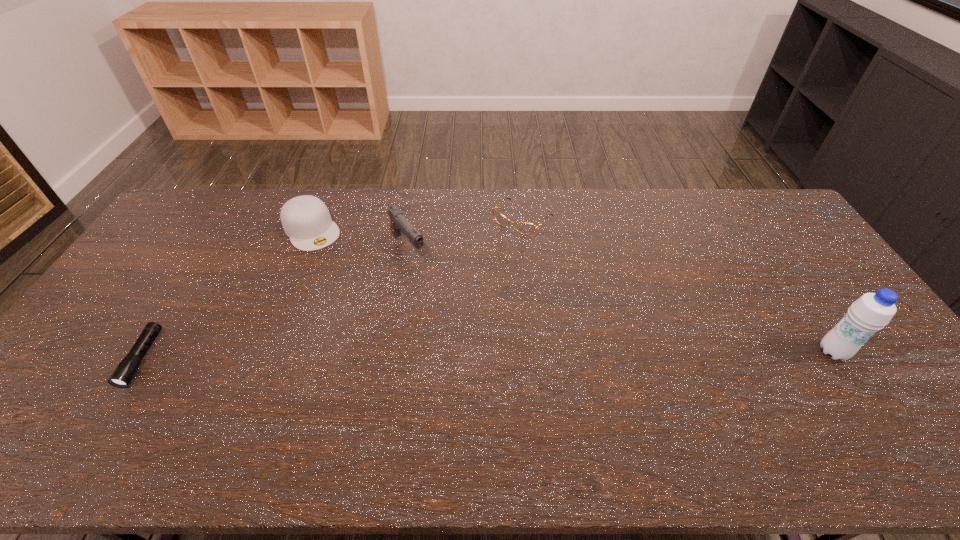
Find the location of `vacant space that's between the spectacles and the leftmost object`. vacant space that's between the spectacles and the leftmost object is located at coordinates (332, 288).

Where is `empty location between the third tallest object and the flashlight`? This screenshot has width=960, height=540. empty location between the third tallest object and the flashlight is located at coordinates (227, 294).

The height and width of the screenshot is (540, 960). Find the location of `vacant space that is in between the spectacles and the third object from left to right`. vacant space that is in between the spectacles and the third object from left to right is located at coordinates (465, 233).

Find the location of `free space between the third tallest object and the water bottle`. free space between the third tallest object and the water bottle is located at coordinates tap(572, 291).

I want to click on free space between the rightmost object and the third object from right to left, so click(x=620, y=300).

Identify the location of free space between the flashlight and the spectacles. This screenshot has width=960, height=540. (332, 288).

Where is `free space between the flashlight and the tallest object`? The height and width of the screenshot is (540, 960). free space between the flashlight and the tallest object is located at coordinates (488, 355).

Identify the location of vacant space that's between the fourth object from left to right and the rightmost object. This screenshot has height=540, width=960. (678, 285).

Find the location of a particular element. The width and height of the screenshot is (960, 540). free space between the spectacles and the third tallest object is located at coordinates (417, 224).

Select which object is the closest to the fourth tallest object. Please provide its 2D coordinates. Your answer should be formatted as a tuple, i.e. [(x, y)], where the tuple contains the x and y coordinates of a point satisfying the conditions above.

[(399, 223)]